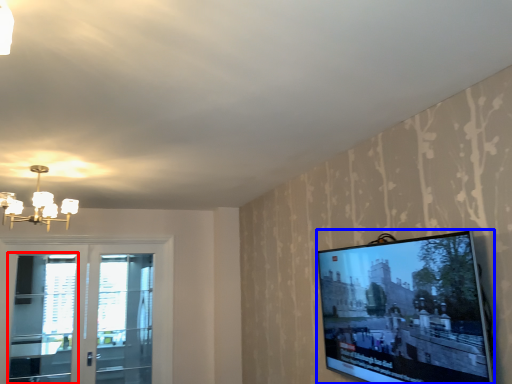
Question: Which object is further to the camera taking this photo, screen door (highlighted by a red box) or television (highlighted by a blue box)?

Choices:
 (A) screen door
 (B) television

Answer: (A)